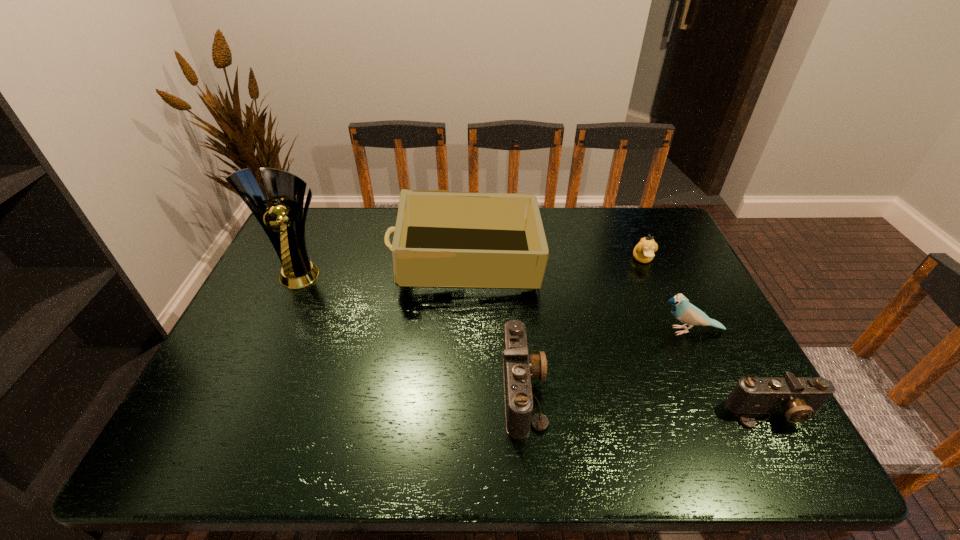
Find the location of a particular element. Image resolution: width=960 pixels, height=540 pixels. vacant spot to place a camera on the left is located at coordinates (294, 368).